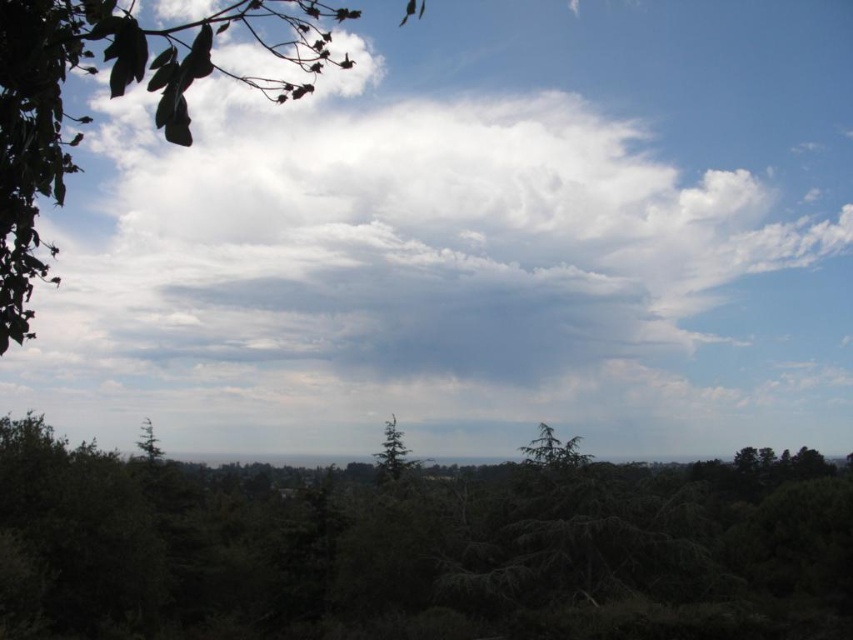
Question: Among these points, which one is farthest from the camera?

Choices:
 (A) (149, 452)
 (B) (563, 467)

Answer: (A)

Question: Can you confirm if green leafy branch at upper left is thinner than green textured tree at center?

Choices:
 (A) yes
 (B) no

Answer: (B)

Question: Which point appears farthest from the camera in this image?

Choices:
 (A) (35, 22)
 (B) (389, 426)
 (C) (138, 340)

Answer: (C)

Question: Is green matte tree at center further to the viewer compared to green matte tree at lower left?

Choices:
 (A) no
 (B) yes

Answer: (A)

Question: Considering the real-world distances, which object is closest to the white fluffy cloud at upper center?

Choices:
 (A) green textured tree at center
 (B) green leafy branch at upper left
 (C) dark green textured trees at lower center
 (D) green matte tree at lower left

Answer: (C)

Question: Can you confirm if dark green textured trees at lower center is positioned to the right of green matte tree at center?

Choices:
 (A) no
 (B) yes

Answer: (A)